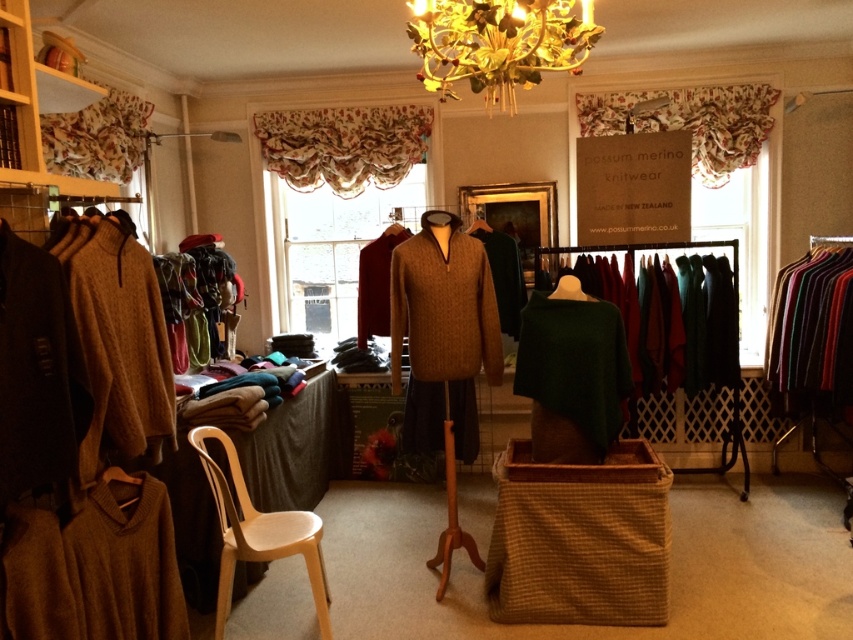
Question: Considering the real-world distances, which object is farthest from the maroon wool sweater at center?

Choices:
 (A) dark brown wool sweater at left
 (B) green wool sweater at center
 (C) knitted beige sweater at left
 (D) matte brown sweater at left

Answer: (A)

Question: Which object is positioned farthest from the knitted wool sweater at right?

Choices:
 (A) maroon wool sweater at center
 (B) white plastic chair at lower left

Answer: (B)

Question: Which point is closer to the camera taking this photo?

Choices:
 (A) [x=115, y=333]
 (B) [x=389, y=308]
 (C) [x=735, y=292]
 (D) [x=251, y=506]

Answer: (A)

Question: Can you confirm if matte brown sweater at left is bigger than knitted beige sweater at left?

Choices:
 (A) yes
 (B) no

Answer: (A)

Question: From the image, what is the correct spatial relationship of green woolen poncho at center in relation to white plastic chair at lower left?

Choices:
 (A) left
 (B) right

Answer: (B)

Question: Does knitted brown sweater at center have a lesser width compared to gold leaf chandelier at upper center?

Choices:
 (A) yes
 (B) no

Answer: (A)